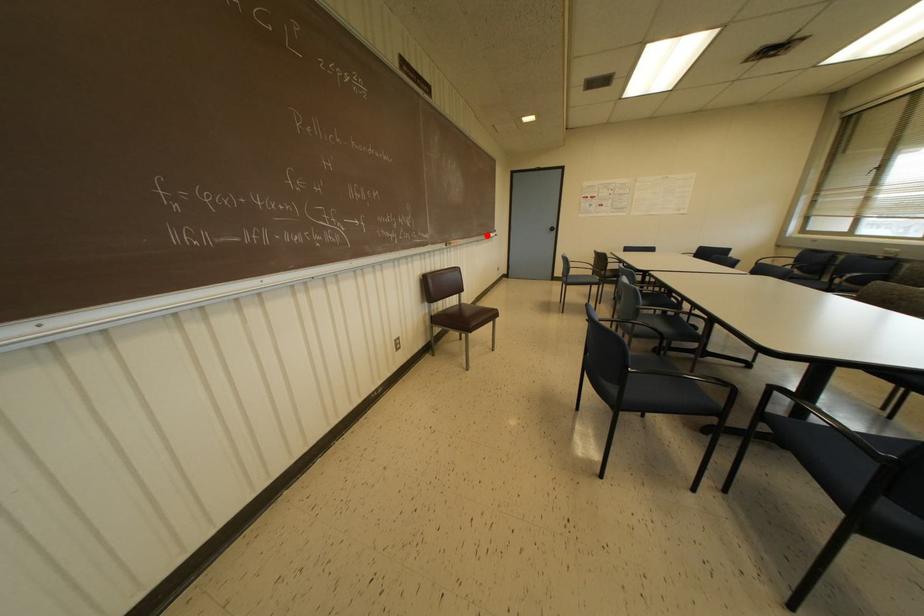
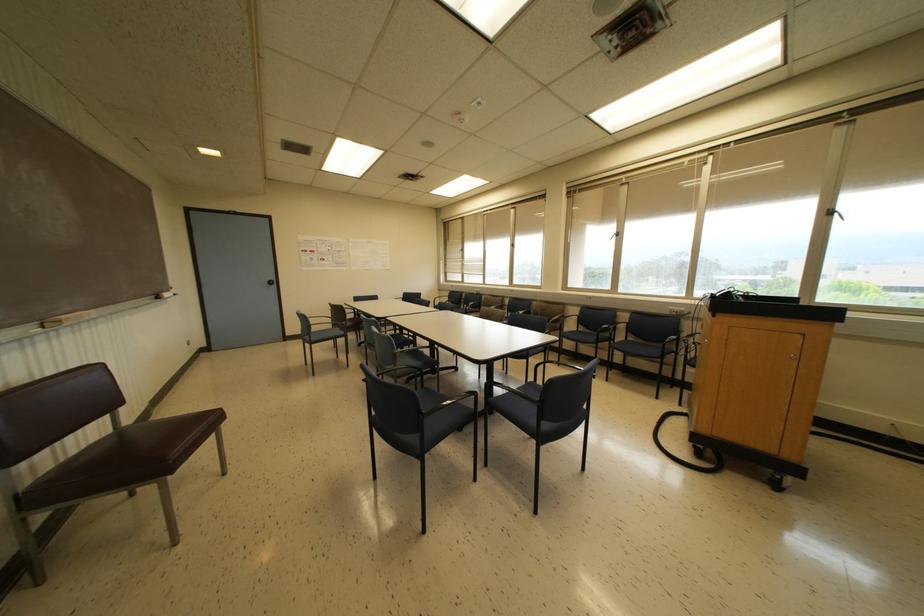
Find the pixel in the second image that matches the highlighted location in the first image.

(157, 297)